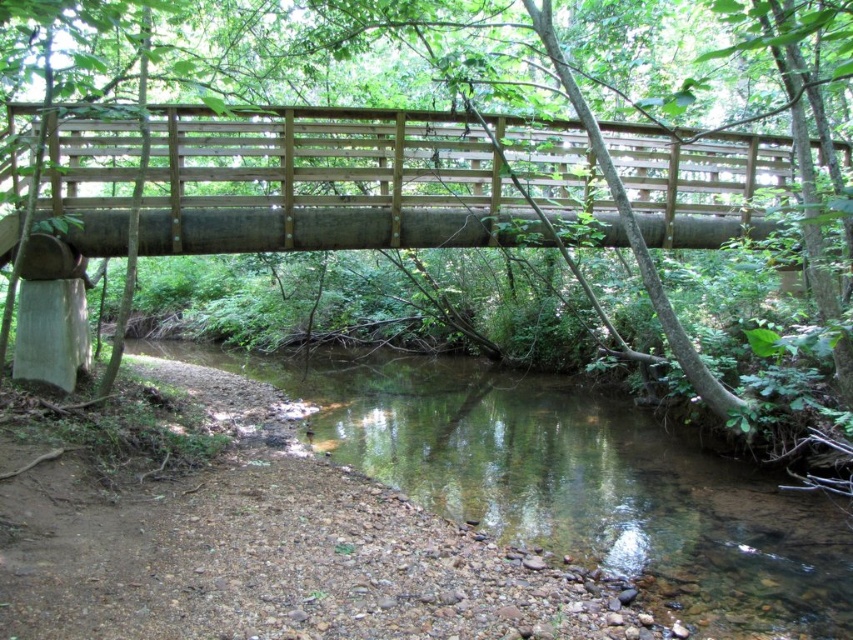
Can you confirm if natural wood bridge at center is thinner than clear water at center?

Incorrect, natural wood bridge at center's width is not less than clear water at center's.

Can you confirm if natural wood bridge at center is positioned above clear water at center?

Yes, natural wood bridge at center is above clear water at center.

Does point (607, 230) come farther from viewer compared to point (662, 522)?

Yes.

Identify the location of natural wood bridge at center. The image size is (853, 640). (326, 182).